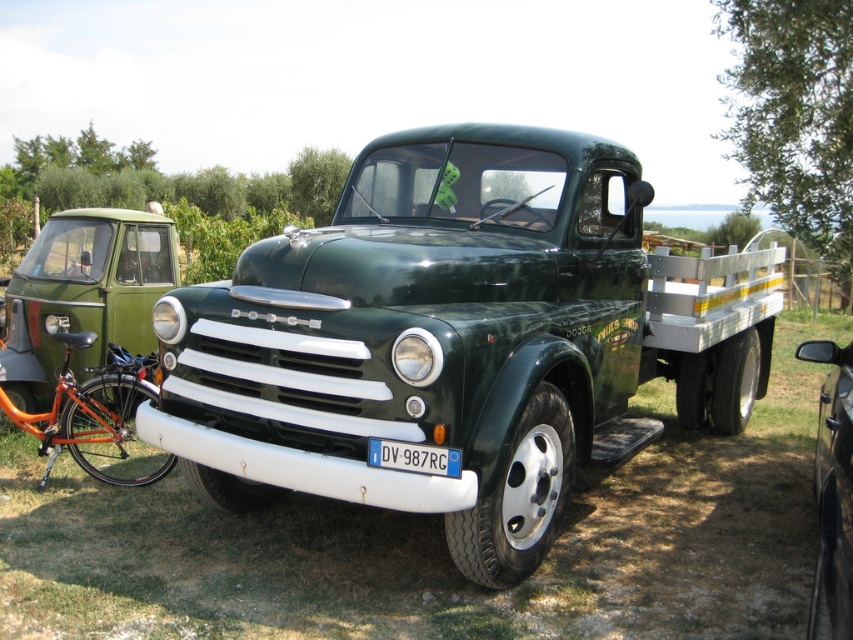
Question: Which object appears farthest from the camera in this image?

Choices:
 (A) green metallic truck at center
 (B) green matte van at left
 (C) orange metallic bicycle at lower left

Answer: (B)

Question: In this image, where is orange metallic bicycle at lower left located relative to blue metallic license plate at center?

Choices:
 (A) right
 (B) left

Answer: (B)

Question: Does orange metallic bicycle at lower left appear over green matte truck at center?

Choices:
 (A) yes
 (B) no

Answer: (B)

Question: Does green matte van at left have a greater width compared to orange metallic bicycle at lower left?

Choices:
 (A) no
 (B) yes

Answer: (B)

Question: Based on their relative distances, which object is farther from the blue metallic license plate at center?

Choices:
 (A) green matte truck at center
 (B) green metallic truck at center
 (C) green matte van at left
 (D) orange metallic bicycle at lower left

Answer: (C)

Question: Which point is closer to the camera?

Choices:
 (A) blue metallic license plate at center
 (B) green matte truck at center

Answer: (B)